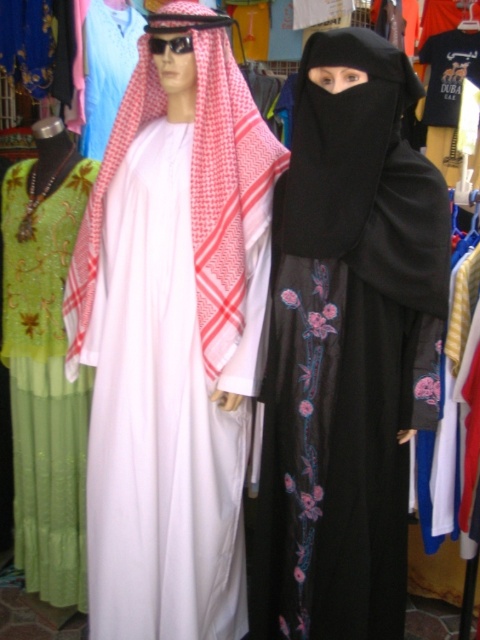
Question: Among these objects, which one is nearest to the camera?

Choices:
 (A) green sequined dress at left
 (B) white matte kandura at center
 (C) black matte niqab at center

Answer: (C)

Question: Does white matte kandura at center appear over black matte niqab at center?

Choices:
 (A) yes
 (B) no

Answer: (A)

Question: Does white matte kandura at center appear on the right side of black matte niqab at center?

Choices:
 (A) yes
 (B) no

Answer: (B)

Question: From the image, what is the correct spatial relationship of white matte kandura at center in relation to black matte niqab at center?

Choices:
 (A) left
 (B) right

Answer: (A)

Question: Which point appears closest to the camera in this image?

Choices:
 (A) (164, 163)
 (B) (348, 288)
 (C) (12, 428)

Answer: (B)

Question: Which object is the farthest from the green sequined dress at left?

Choices:
 (A) white matte kandura at center
 (B) black matte niqab at center

Answer: (B)